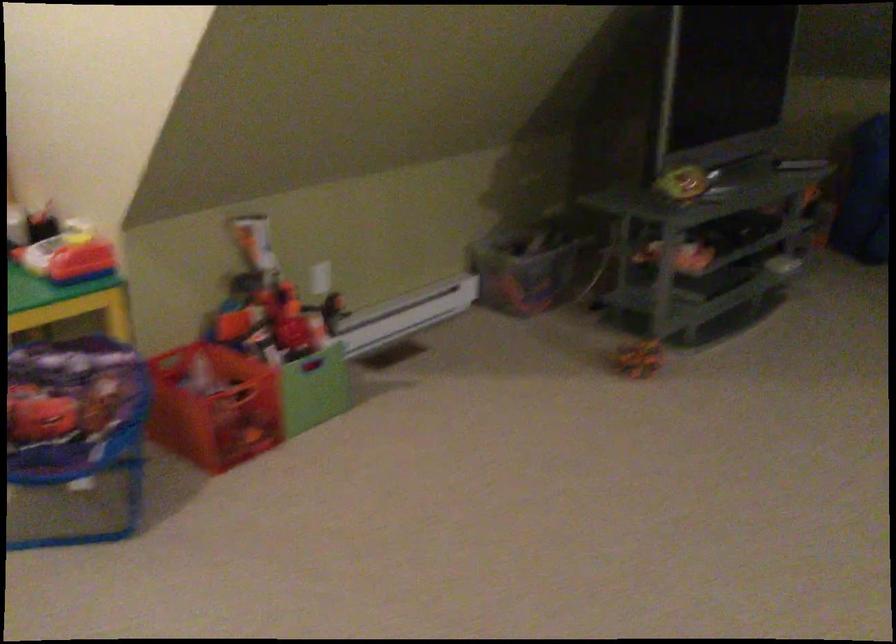
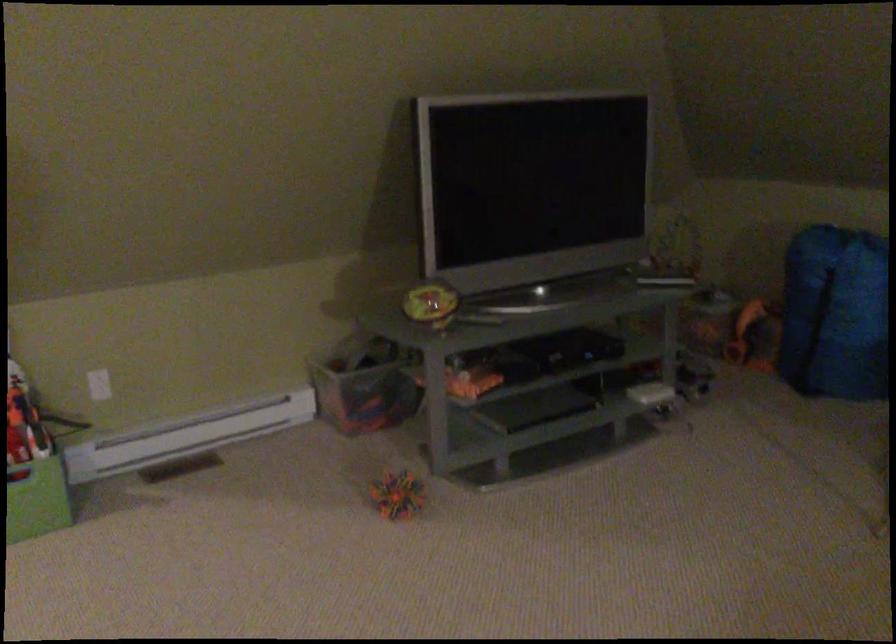
Find the pixel in the second image that matches point 316,275 in the first image.

(99, 384)